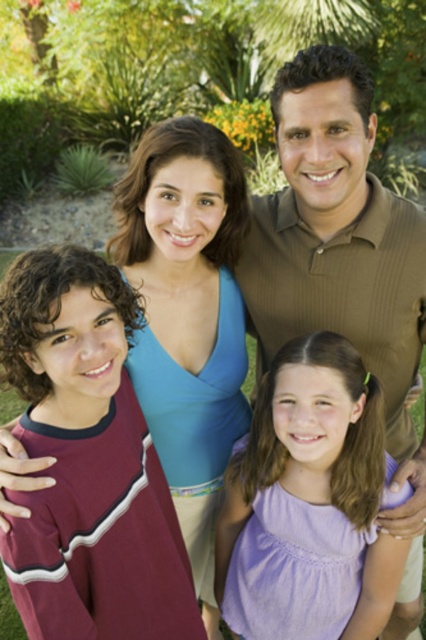
Which is above, brown textured shirt at upper center or purple cotton dress at center?

brown textured shirt at upper center is above.

Is point (377, 228) farther from viewer compared to point (316, 484)?

Yes, it is behind point (316, 484).

Is point (340, 321) positioned after point (379, 436)?

Yes, it is.

Locate an element on the screen. Image resolution: width=426 pixels, height=640 pixels. brown textured shirt at upper center is located at coordinates (342, 262).

Does point (334, 76) lie behind point (143, 170)?

No, it is not.

Between brown textured shirt at upper center and blue fabric dress at upper center, which one appears on the right side from the viewer's perspective?

brown textured shirt at upper center

Is point (299, 220) positioned after point (189, 132)?

Yes, point (299, 220) is farther from viewer.

The width and height of the screenshot is (426, 640). In order to click on brown textured shirt at upper center in this screenshot , I will do `click(342, 262)`.

In the scene shown: Who is lower down, blue fabric dress at upper center or purple cotton dress at center?

purple cotton dress at center is lower down.

The width and height of the screenshot is (426, 640). Find the location of `blue fabric dress at upper center`. blue fabric dress at upper center is located at coordinates (187, 316).

Locate an element on the screen. blue fabric dress at upper center is located at coordinates (187, 316).